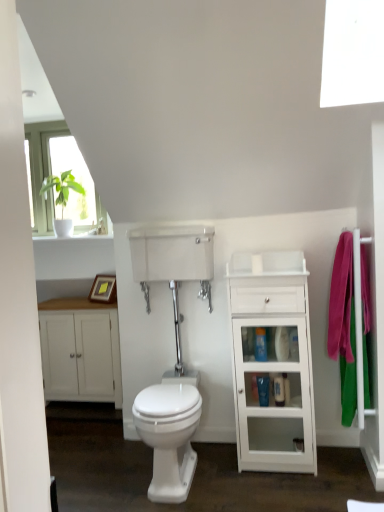
What do you see at coordinates (272, 361) in the screenshot?
I see `white glossy cabinet at right` at bounding box center [272, 361].

Describe the element at coordinates (344, 325) in the screenshot. I see `pink fabric towel at right` at that location.

Find the location of a particular element. This screenshot has width=384, height=512. pink fabric towel at right is located at coordinates (344, 325).

Identify the location of white glossy bidet at center. Image resolution: width=384 pixels, height=512 pixels. (169, 437).

Image resolution: width=384 pixels, height=512 pixels. In order to click on toiletry above the white matte cabinet at left (from the image's perspective) in this screenshot , I will do `click(260, 344)`.

Could you measure the distance between blue glossy toiletries at center, the first toiletry viewed from the top, and white matte cabinet at left?

blue glossy toiletries at center, the first toiletry viewed from the top, is 1.38 meters away from white matte cabinet at left.

From the image's perspective, relative to white matte cabinet at left, is blue glossy toiletries at center, the first toiletry in the left-to-right sequence, above or below?

Based on their image positions, blue glossy toiletries at center, the first toiletry in the left-to-right sequence, is located above white matte cabinet at left.

Which object is wider, blue glossy toiletries at center, positioned as the 2th toiletry in right-to-left order, or white matte cabinet at left?

white matte cabinet at left is wider.

How much distance is there between transparent plastic tank at center and white matte cabinet at left?

transparent plastic tank at center and white matte cabinet at left are 33.11 inches apart.

Is transparent plastic tank at center at the right side of white matte cabinet at left?

Indeed, transparent plastic tank at center is positioned on the right side of white matte cabinet at left.

Are transparent plastic tank at center and white matte cabinet at left beside each other?

No, transparent plastic tank at center is not in contact with white matte cabinet at left.

Considering the sizes of objects transparent plastic tank at center and white matte cabinet at left in the image provided, who is shorter, transparent plastic tank at center or white matte cabinet at left?

transparent plastic tank at center is shorter.

Considering the relative positions of blue glossy toiletries at center, the first toiletry viewed from the top, and white glossy cabinet at right in the image provided, is blue glossy toiletries at center, the first toiletry viewed from the top, in front of white glossy cabinet at right?

No, it is behind white glossy cabinet at right.

Which is farther from the camera, (258,344) or (239,324)?

The point (258,344) is farther.

Is blue glossy toiletries at center, the first toiletry in the left-to-right sequence, oriented away from white glossy cabinet at right?

Absolutely, blue glossy toiletries at center, the first toiletry in the left-to-right sequence, is directed away from white glossy cabinet at right.

Is there a large distance between blue glossy toiletries at center, the first toiletry viewed from the top, and white glossy cabinet at right?

No, blue glossy toiletries at center, the first toiletry viewed from the top, is not far from white glossy cabinet at right.

Which object is wider, pink fabric towel at right or blue glossy toiletries at center, positioned as the 2th toiletry in right-to-left order?

Wider between the two is pink fabric towel at right.

Is pink fabric towel at right turned away from blue glossy toiletries at center, the 2th toiletry when ordered from bottom to top?

Yes, pink fabric towel at right is facing away from blue glossy toiletries at center, the 2th toiletry when ordered from bottom to top.

From a real-world perspective, which is physically below, pink fabric towel at right or blue glossy toiletries at center, positioned as the 2th toiletry in right-to-left order?

blue glossy toiletries at center, positioned as the 2th toiletry in right-to-left order.

From the picture: Considering the positions of objects pink fabric towel at right and blue glossy toiletries at center, positioned as the 2th toiletry in right-to-left order, in the image provided, who is more to the right, pink fabric towel at right or blue glossy toiletries at center, positioned as the 2th toiletry in right-to-left order,?

pink fabric towel at right.

Is white glossy cabinet at right bigger than pink fabric towel at right?

Yes, white glossy cabinet at right is bigger than pink fabric towel at right.

How many degrees apart are the facing directions of white glossy cabinet at right and pink fabric towel at right?

90.5 degrees.

Which object is further away from the camera, white glossy cabinet at right or pink fabric towel at right?

white glossy cabinet at right is behind.

Can you confirm if white glossy cabinet at right is shorter than pink fabric towel at right?

Incorrect, the height of white glossy cabinet at right does not fall short of that of pink fabric towel at right.

In terms of width, does transparent plastic tank at center look wider or thinner when compared to pink fabric towel at right?

Considering their sizes, transparent plastic tank at center looks broader than pink fabric towel at right.

What's the angular difference between transparent plastic tank at center and pink fabric towel at right's facing directions?

92.1 degrees.

Who is taller, transparent plastic tank at center or pink fabric towel at right?

With more height is pink fabric towel at right.

Is transparent plastic tank at center next to pink fabric towel at right and touching it?

No, transparent plastic tank at center is not beside pink fabric towel at right.

Does white glossy bidet at center have a lesser width compared to pink fabric towel at right?

In fact, white glossy bidet at center might be wider than pink fabric towel at right.

From their relative heights in the image, would you say white glossy bidet at center is taller or shorter than pink fabric towel at right?

Considering their sizes, white glossy bidet at center has less height than pink fabric towel at right.

Based on the photo, from the image's perspective, who appears lower, white glossy bidet at center or pink fabric towel at right?

white glossy bidet at center, from the image's perspective.

Which is less distant, (175, 405) or (331, 290)?

The point (175, 405) is closer to the camera.

Locate an element on the screen. This screenshot has height=512, width=384. bathroom cabinet on the left side of blue glossy toiletries at center, the first toiletry viewed from the top is located at coordinates (80, 350).

Locate an element on the screen. The height and width of the screenshot is (512, 384). bathroom cabinet lying below the transparent plastic tank at center (from the image's perspective) is located at coordinates (80, 350).

Looking at the image, which one is located further to transparent plastic tank at center, blue glossy toiletries at center, the first toiletry viewed from the top, or white glossy cabinet at right?

Based on the image, blue glossy toiletries at center, the first toiletry viewed from the top, appears to be further to transparent plastic tank at center.

When comparing their distances from blue glossy toiletries at center, positioned as the 2th toiletry in right-to-left order, does white glossy cabinet at right or transparent plastic tank at center seem further?

transparent plastic tank at center lies further to blue glossy toiletries at center, positioned as the 2th toiletry in right-to-left order, than the other object.

When comparing their distances from white glossy cabinet at right, does white matte cabinet at left or blue glossy toiletries at center, the 1th toiletry in the right-to-left sequence, seem further?

white matte cabinet at left.

Estimate the real-world distances between objects in this image. Which object is closer to pink fabric towel at right, blue glossy toiletries at center, the first toiletry in the left-to-right sequence, or white glossy cabinet at right?

white glossy cabinet at right.

From the image, which object appears to be farther from blue glossy toiletries at center, the 2th toiletry viewed from the top, blue glossy toiletries at center, the first toiletry viewed from the top, or white matte cabinet at left?

white matte cabinet at left is further to blue glossy toiletries at center, the 2th toiletry viewed from the top.

From the image, which object appears to be nearer to blue glossy toiletries at center, positioned as the 2th toiletry in right-to-left order, pink fabric towel at right or white glossy bidet at center?

pink fabric towel at right is closer to blue glossy toiletries at center, positioned as the 2th toiletry in right-to-left order.

Which object lies further to the anchor point transparent plastic tank at center, white glossy cabinet at right or white glossy bidet at center?

white glossy bidet at center.

Looking at the image, which one is located further to transparent plastic tank at center, blue glossy toiletries at center, the 2th toiletry viewed from the top, or white glossy cabinet at right?

blue glossy toiletries at center, the 2th toiletry viewed from the top, is positioned further to the anchor transparent plastic tank at center.

Where is `bathroom cabinet between transparent plastic tank at center and white glossy bidet at center in the vertical direction`? bathroom cabinet between transparent plastic tank at center and white glossy bidet at center in the vertical direction is located at coordinates (80, 350).

Locate an element on the screen. The image size is (384, 512). cabinetry between white glossy bidet at center and pink fabric towel at right from left to right is located at coordinates (272, 361).

Where is `toiletry located between white glossy cabinet at right and pink fabric towel at right in the left-right direction`? toiletry located between white glossy cabinet at right and pink fabric towel at right in the left-right direction is located at coordinates (279, 390).

I want to click on toiletry between white glossy bidet at center and white glossy cabinet at right, so click(260, 344).